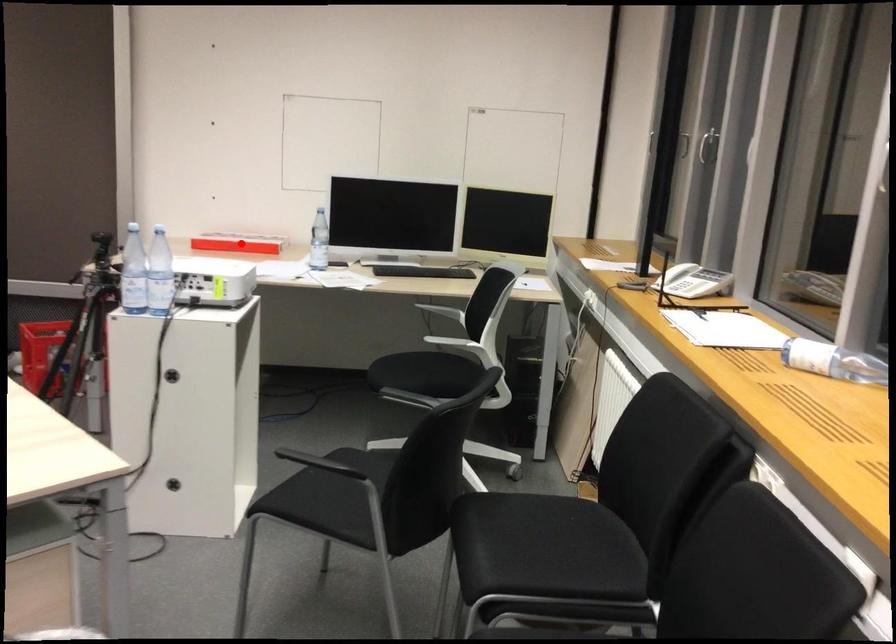
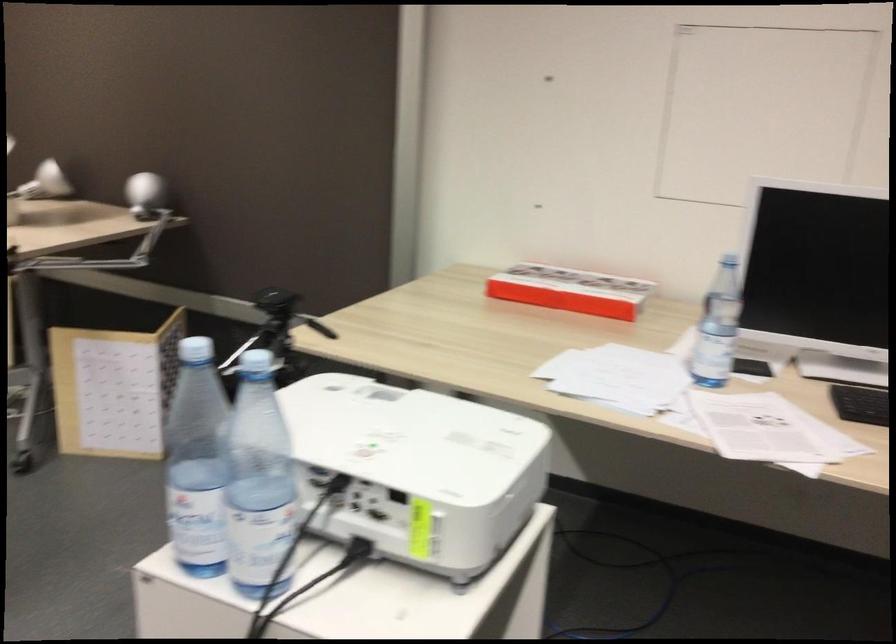
Question: I am providing you with two images of the same scene from different viewpoints. Image1 has a red point marked. In image2, the corresponding 3D location appears at what relative position? Reply with the corresponding letter.

Choices:
 (A) Closer
 (B) Farther

Answer: (A)